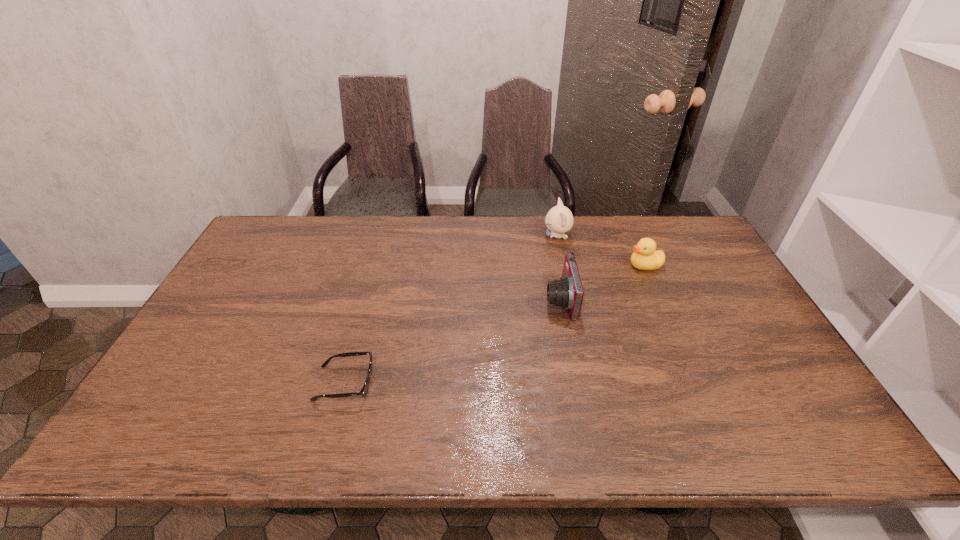
What are the coordinates of `kitten` in the screenshot? It's located at (559, 219).

What are the coordinates of `camera` in the screenshot? It's located at (567, 292).

Identify the location of the third nearest object. The height and width of the screenshot is (540, 960). (645, 257).

Where is `duck`? duck is located at coordinates (645, 257).

This screenshot has width=960, height=540. I want to click on the leftmost object, so click(363, 392).

I want to click on the shortest object, so click(363, 392).

I want to click on vacant area situated on the face of the farthest object, so click(x=466, y=236).

This screenshot has height=540, width=960. Find the location of `vacant space located 0.330m on the face of the farthest object`. vacant space located 0.330m on the face of the farthest object is located at coordinates (448, 236).

Where is `vacant region located 0.310m on the face of the farthest object`? Image resolution: width=960 pixels, height=540 pixels. vacant region located 0.310m on the face of the farthest object is located at coordinates (454, 236).

Find the location of a particular element. vacant space positioned on the front-facing side of the second nearest object is located at coordinates (432, 300).